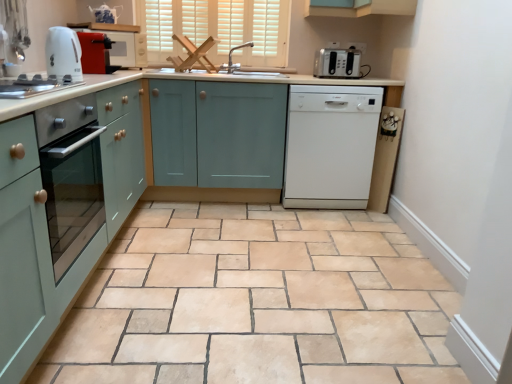
Question: Is teal matte cabinet at center, which is the 1th cabinetry in right-to-left order, shorter than satin silver toaster at upper right, the 3th kitchen appliance from the bottom?

Choices:
 (A) yes
 (B) no

Answer: (B)

Question: From a real-world perspective, is teal matte cabinet at center, acting as the 2th cabinetry starting from the left, physically below satin silver toaster at upper right, the 3th kitchen appliance from the bottom?

Choices:
 (A) no
 (B) yes

Answer: (B)

Question: Could you tell me if teal matte cabinet at center, which is the 1th cabinetry in right-to-left order, is facing satin silver toaster at upper right, the third kitchen appliance in the front-to-back sequence?

Choices:
 (A) yes
 (B) no

Answer: (B)

Question: Is teal matte cabinet at center, which is the 1th cabinetry in right-to-left order, wider than satin silver toaster at upper right, which is counted as the 1th kitchen appliance, starting from the back?

Choices:
 (A) yes
 (B) no

Answer: (A)

Question: From the image's perspective, is teal matte cabinet at center, acting as the 2th cabinetry starting from the left, on satin silver toaster at upper right, the 3th kitchen appliance from the bottom?

Choices:
 (A) yes
 (B) no

Answer: (B)

Question: Is teal matte cabinet at center, which is the 1th cabinetry in right-to-left order, further to the viewer compared to satin silver toaster at upper right, the 3th kitchen appliance from the bottom?

Choices:
 (A) yes
 (B) no

Answer: (B)

Question: Can you confirm if teal matte cabinet at center, acting as the 2th cabinetry starting from the left, is positioned to the right of white glossy countertop at center?

Choices:
 (A) yes
 (B) no

Answer: (A)

Question: From the image's perspective, would you say teal matte cabinet at center, acting as the 2th cabinetry starting from the left, is positioned over white glossy countertop at center?

Choices:
 (A) yes
 (B) no

Answer: (A)

Question: Can you confirm if teal matte cabinet at center, acting as the 2th cabinetry starting from the left, is smaller than white glossy countertop at center?

Choices:
 (A) yes
 (B) no

Answer: (A)

Question: Is teal matte cabinet at center, which is the 1th cabinetry in right-to-left order, bigger than white glossy countertop at center?

Choices:
 (A) yes
 (B) no

Answer: (B)

Question: Could you tell me if teal matte cabinet at center, which is the 1th cabinetry in right-to-left order, is turned towards white glossy countertop at center?

Choices:
 (A) no
 (B) yes

Answer: (B)

Question: Is teal matte cabinet at center, acting as the 2th cabinetry starting from the left, positioned before white glossy countertop at center?

Choices:
 (A) no
 (B) yes

Answer: (A)

Question: From a real-world perspective, is white glossy dishwasher at center, acting as the 2th home appliance starting from the left, on top of teal matte cabinet at center, acting as the 2th cabinetry starting from the left?

Choices:
 (A) yes
 (B) no

Answer: (A)